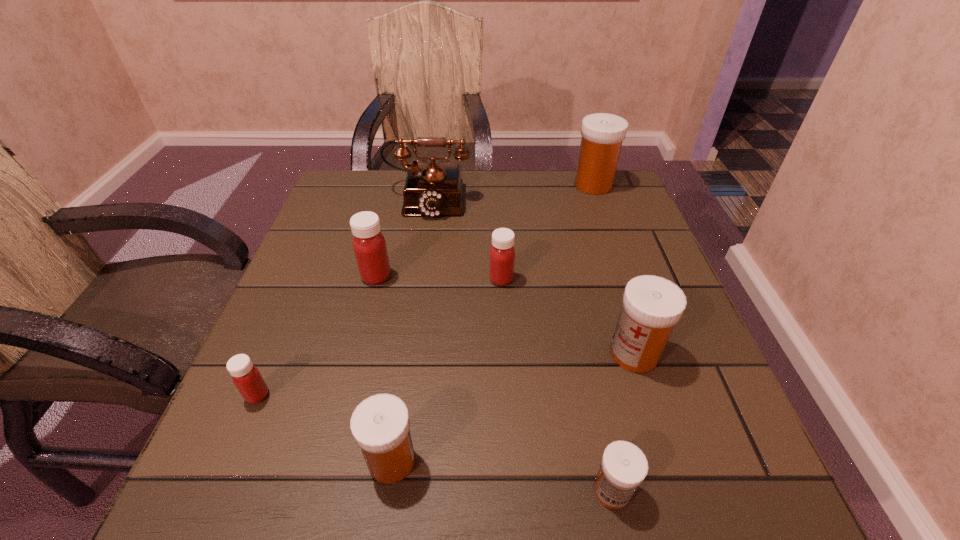
Where is `the leftmost white medicine`? Image resolution: width=960 pixels, height=540 pixels. the leftmost white medicine is located at coordinates (380, 424).

The width and height of the screenshot is (960, 540). I want to click on the fifth farthest medicine, so click(x=246, y=377).

You are a GUI agent. You are given a task and a screenshot of the screen. Output one action in this format:
    pyautogui.click(x=<x>, y=<y>)
    Task: Click on the smallest red medicine
    This screenshot has width=960, height=540.
    Given the screenshot: What is the action you would take?
    pyautogui.click(x=246, y=377)

Where is `the fifth medicine from left to right`? the fifth medicine from left to right is located at coordinates (624, 466).

This screenshot has width=960, height=540. In order to click on the sixth object from left to right in this screenshot , I will do `click(624, 466)`.

Locate an element on the screen. vacant point located 0.350m on the left of the farthest medicine is located at coordinates (445, 185).

Identify the location of free region located on the dial of the telephone. (406, 346).

Find the location of `vacant position located on the right of the sixth medicine from right to left`. vacant position located on the right of the sixth medicine from right to left is located at coordinates (550, 276).

Locate an element on the screen. The width and height of the screenshot is (960, 540). free spot located on the left of the third smallest white medicine is located at coordinates (492, 354).

This screenshot has height=540, width=960. Identify the location of vacant space situated 0.270m on the front of the fourth medicine from right to left. (508, 403).